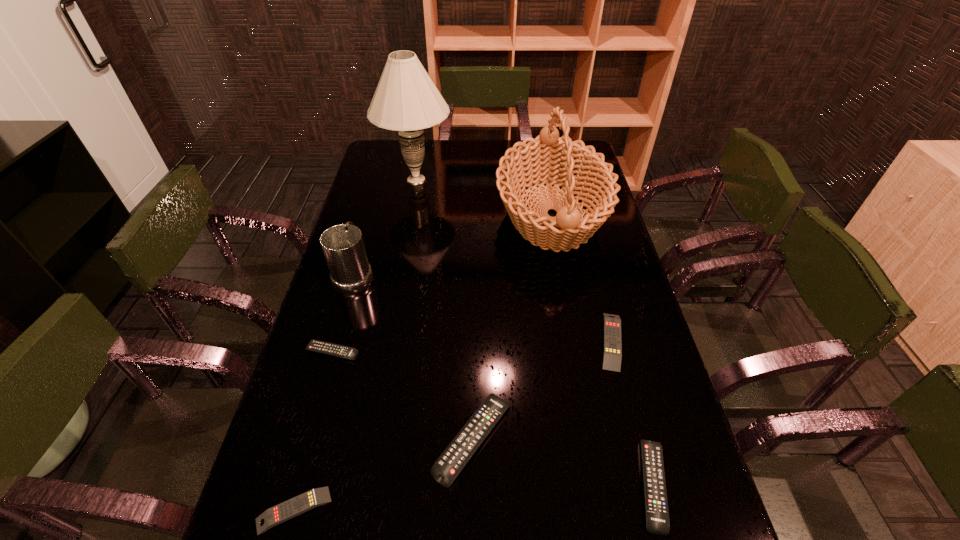
At what (x,y) coordinates should I click in order to perform the action: click on the second biggest black remote control. Please return your answer as a coordinate pair (x, y). Image resolution: width=960 pixels, height=540 pixels. Looking at the image, I should click on (656, 506).

Locate an element on the screen. The width and height of the screenshot is (960, 540). the smaller yellow remote control is located at coordinates (291, 508).

Find the location of a particular element. the left yellow remote control is located at coordinates (291, 508).

This screenshot has height=540, width=960. Find the location of `the leftmost black remote control`. the leftmost black remote control is located at coordinates (318, 346).

You are a GUI agent. You are given a task and a screenshot of the screen. Output one action in this format:
    pyautogui.click(x=<x>, y=<y>)
    Task: Click on the farthest black remote control
    The image size is (960, 540).
    Given the screenshot: What is the action you would take?
    (318, 346)

Where is `free location located on the back of the tallest object`? free location located on the back of the tallest object is located at coordinates (421, 150).

The image size is (960, 540). What are the coordinates of `vacant region located 0.110m on the front of the basket` in the screenshot? It's located at (567, 299).

Find the location of `vacant space located 0.360m on the side of the sixth shortest object with the handle`. vacant space located 0.360m on the side of the sixth shortest object with the handle is located at coordinates (378, 191).

Where is `free spot located on the side of the sixth shortest object with the handle`? This screenshot has width=960, height=540. free spot located on the side of the sixth shortest object with the handle is located at coordinates (371, 219).

The image size is (960, 540). In order to click on vacant region located 0.060m on the side of the sixth shortest object with the handle in this screenshot , I will do `click(364, 242)`.